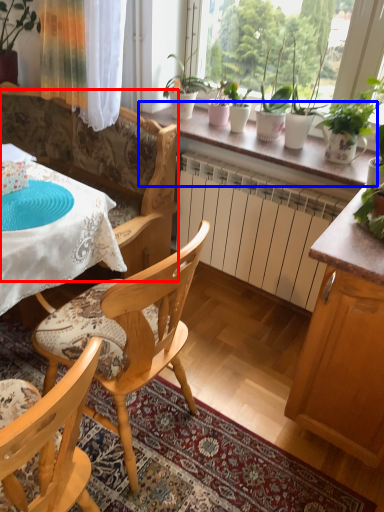
Question: Which point is closer to the camera, couch (highlighted by a red box) or window sill (highlighted by a blue box)?

Choices:
 (A) couch
 (B) window sill

Answer: (A)